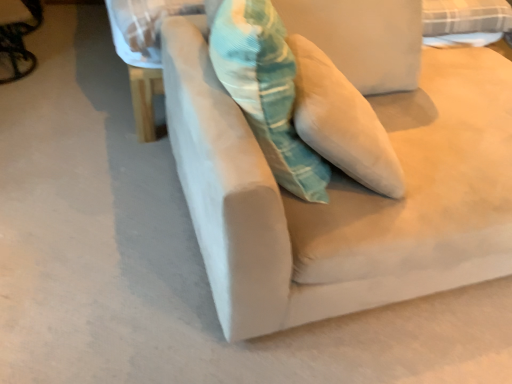
You are a GUI agent. You are given a task and a screenshot of the screen. Output one action in this format:
    pyautogui.click(x=<x>, y=<y>)
    Task: Click on the vacant space behind metallic silver swivel chair at left
    The width and height of the screenshot is (512, 384).
    Given the screenshot: What is the action you would take?
    pyautogui.click(x=61, y=50)